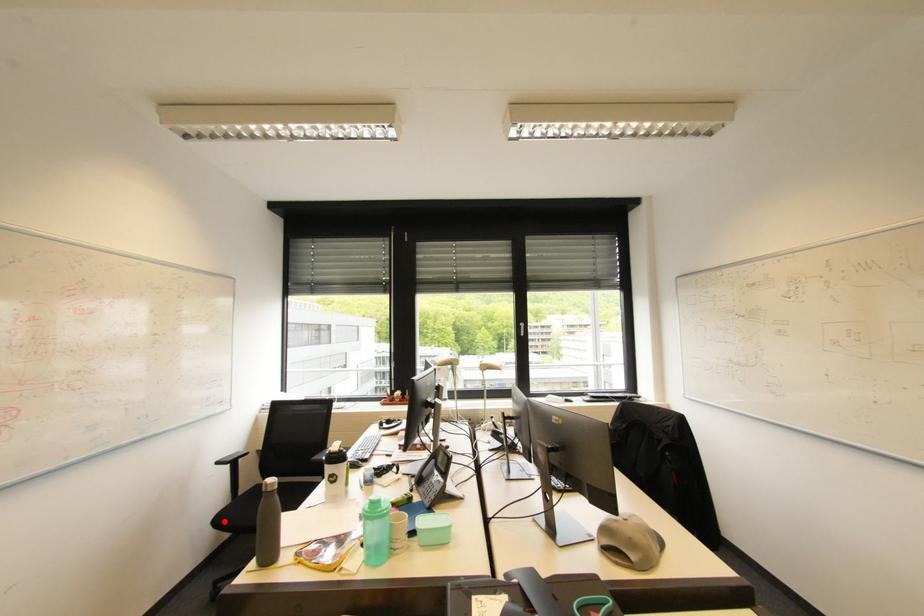
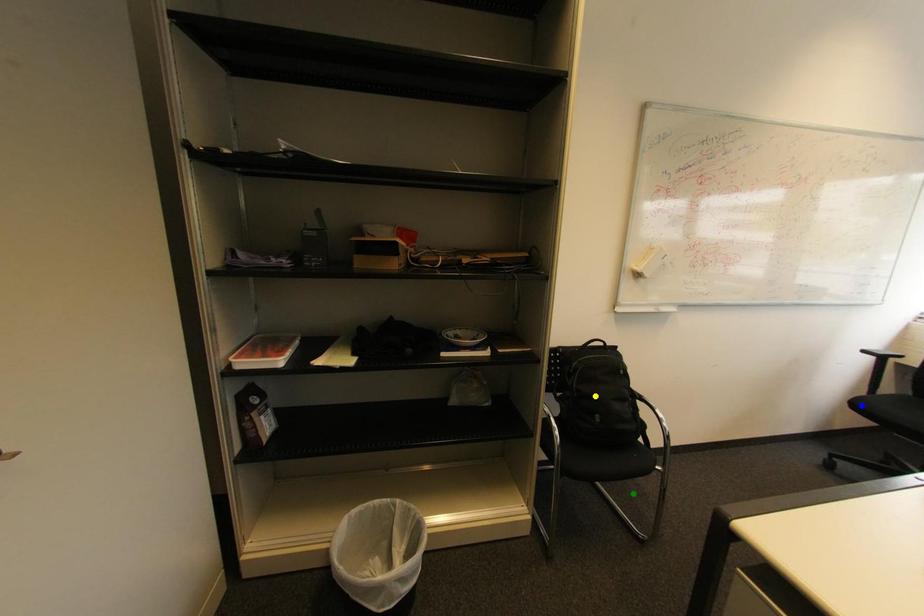
Question: I am providing you with two images of the same scene from different viewpoints. A red point is marked on the first image. You are given multiple points on the second image. Which point in image 2 represents the same 3d spot as the red point in image 1?

Choices:
 (A) yellow point
 (B) green point
 (C) blue point

Answer: (C)